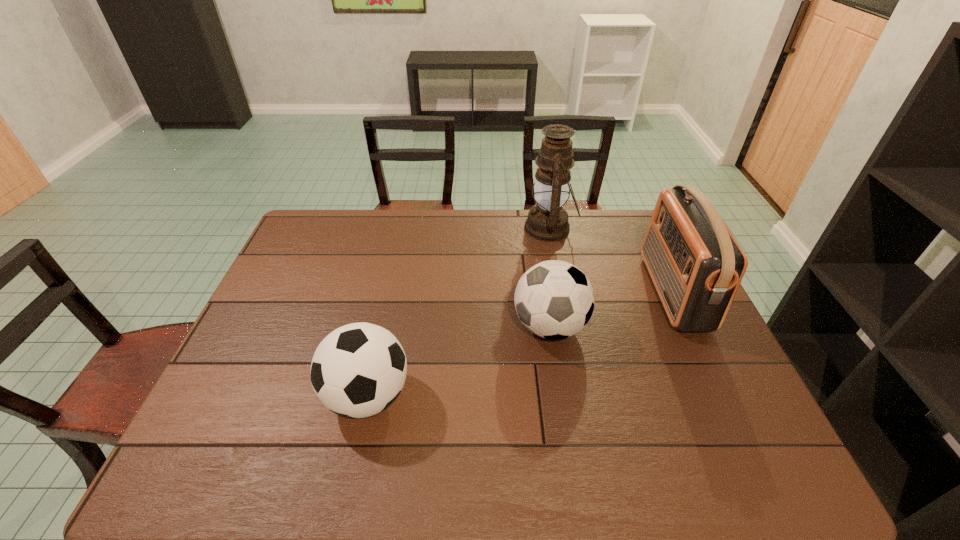
Select which object appears as the third closest to the nearest object. Please provide its 2D coordinates. Your answer should be formatted as a tuple, i.e. [(x, y)], where the tuple contains the x and y coordinates of a point satisfying the conditions above.

[(696, 264)]

The image size is (960, 540). In order to click on object that stands as the second closest to the left soccer ball in this screenshot , I will do `click(547, 221)`.